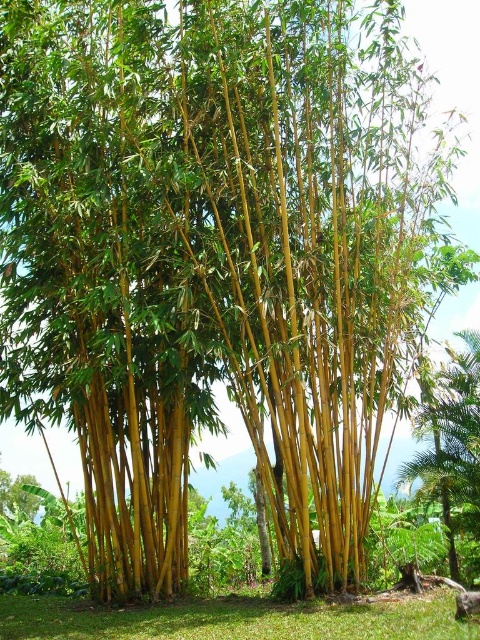
Question: Which of the following is the farthest from the observer?

Choices:
 (A) green leafy tree at lower left
 (B) green bamboo at lower right

Answer: (A)

Question: Does green bamboo at lower right have a greater width compared to green leafy tree at lower left?

Choices:
 (A) yes
 (B) no

Answer: (A)

Question: Is the position of green bamboo at lower right more distant than that of green leafy tree at lower left?

Choices:
 (A) yes
 (B) no

Answer: (B)

Question: Does green bamboo at lower right have a smaller size compared to green leafy tree at lower left?

Choices:
 (A) no
 (B) yes

Answer: (A)

Question: Which point is closer to the camera?

Choices:
 (A) green bamboo at lower right
 (B) green leafy tree at lower left

Answer: (A)

Question: Which point is closer to the camera?

Choices:
 (A) (425, 467)
 (B) (9, 500)

Answer: (A)